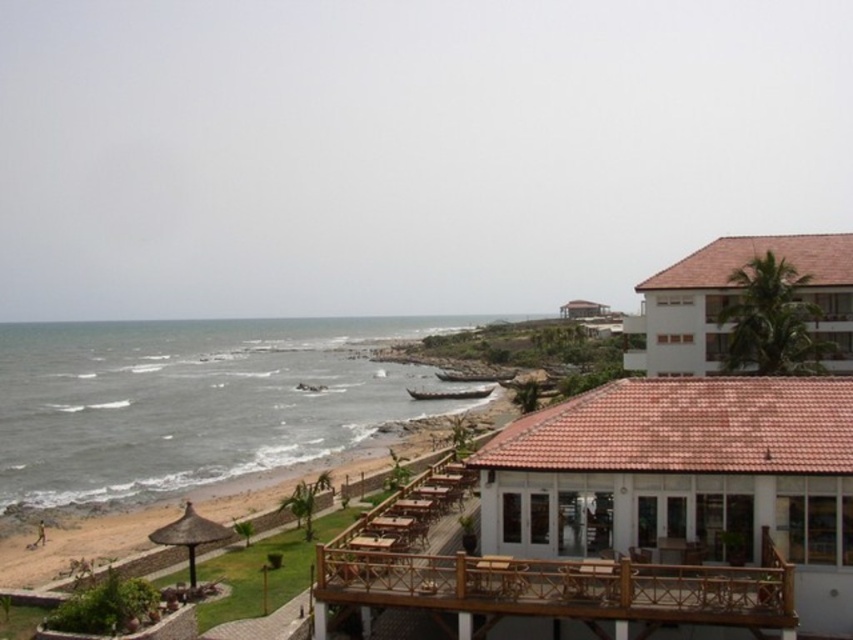
You are standing at the wooden deck with tables and chairs in the foreground of the coastal scene. You want to locate the point at coordinates point (685, 477). Based on the description, where exactly is this point located?

The point (685, 477) is located on the brown tile roof at upper right.

You are designing a coastal landscape poster and need to ensure the gray water at lower left and brown tile roof at upper right are proportionally accurate. Based on the scene, which object should occupy more horizontal space on the poster?

The gray water at lower left should occupy more horizontal space on the poster because its width is larger than that of the brown tile roof at upper right according to the description.